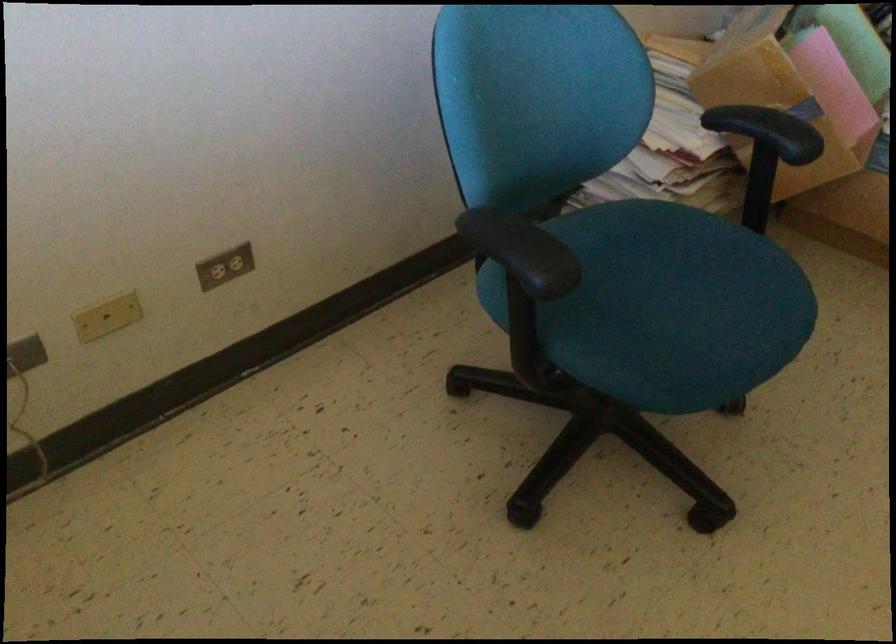
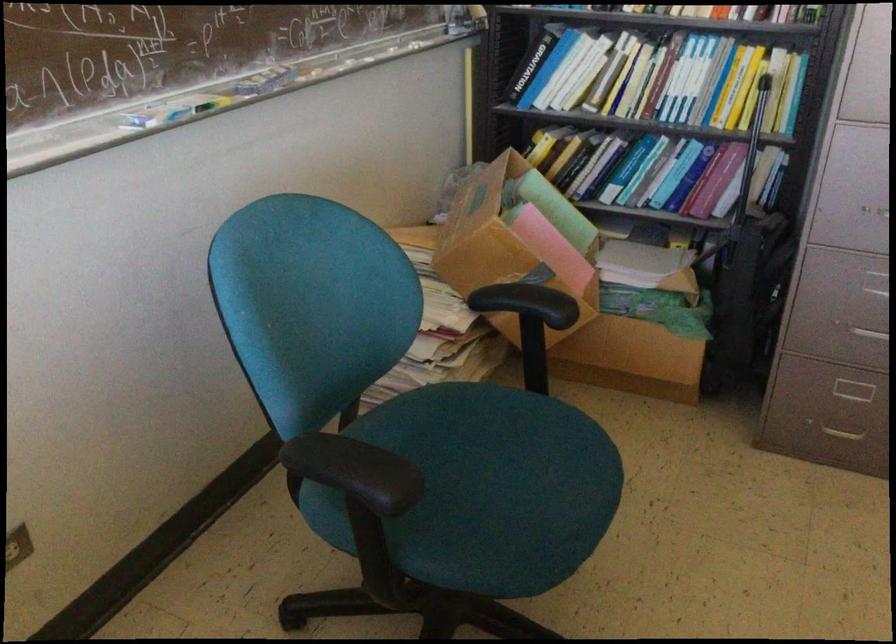
The point at (679, 281) is marked in the first image. Where is the corresponding point in the second image?

(498, 458)